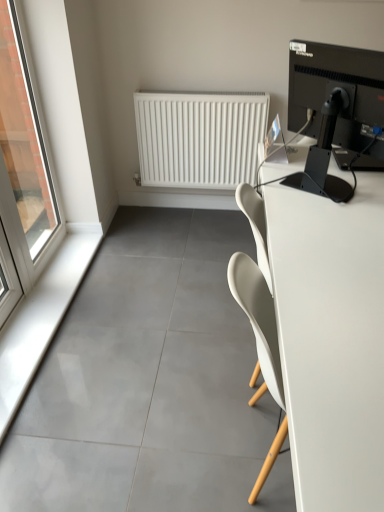
Question: Would you say white matte radiator at upper center is to the left or to the right of transparent glass window at left in the picture?

Choices:
 (A) right
 (B) left

Answer: (A)

Question: Looking at the image, does white matte radiator at upper center seem bigger or smaller compared to transparent glass window at left?

Choices:
 (A) big
 (B) small

Answer: (B)

Question: Estimate the real-world distances between objects in this image. Which object is farther from the white glossy window sill at lower left?

Choices:
 (A) black glossy monitor at upper right
 (B) transparent glass window at left
 (C) white matte desk at right
 (D) white matte radiator at upper center

Answer: (A)

Question: Estimate the real-world distances between objects in this image. Which object is farther from the transparent glass window at left?

Choices:
 (A) white matte desk at right
 (B) white glossy window sill at lower left
 (C) white matte radiator at upper center
 (D) black glossy monitor at upper right

Answer: (A)